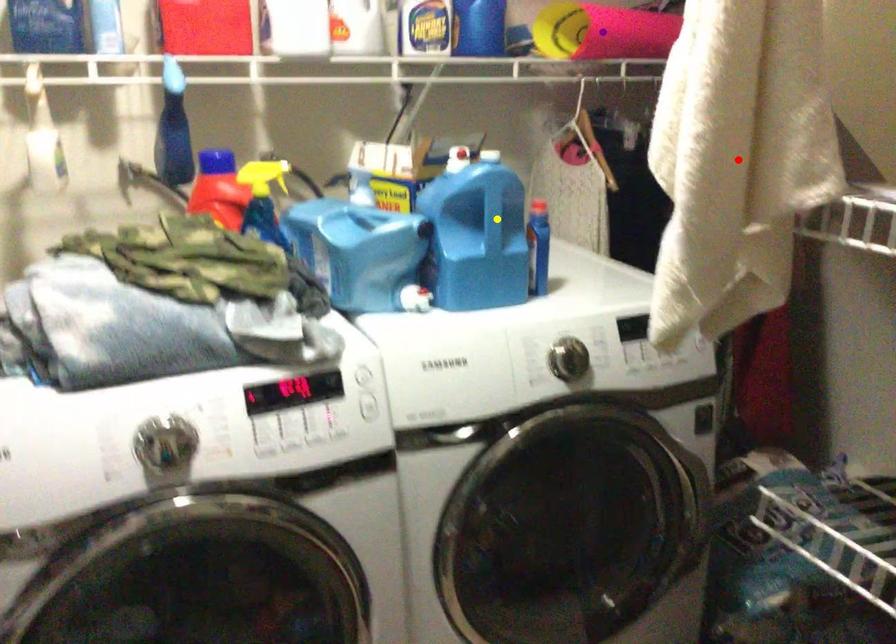
Order these from nearest to farthest:
purple point
yellow point
red point

purple point < yellow point < red point